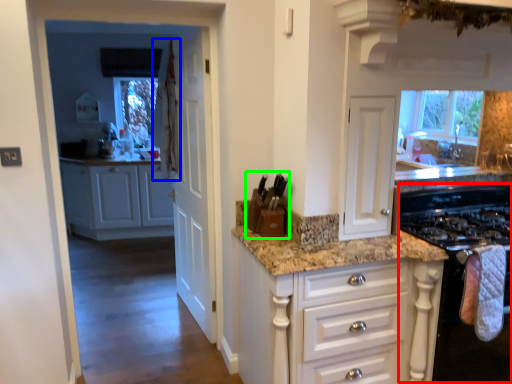
Question: Which object is the farthest from appliance (highlighted by a red box)? Choose among these: curtain (highlighted by a blue box) or appliance (highlighted by a green box).

Choices:
 (A) curtain
 (B) appliance

Answer: (A)